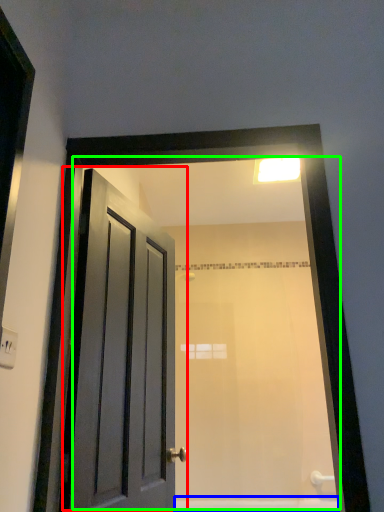
Question: Considering the real-world distances, which object is closest to door (highlighted by a red box)? bath (highlighted by a blue box) or mirror (highlighted by a green box).

Choices:
 (A) bath
 (B) mirror

Answer: (B)